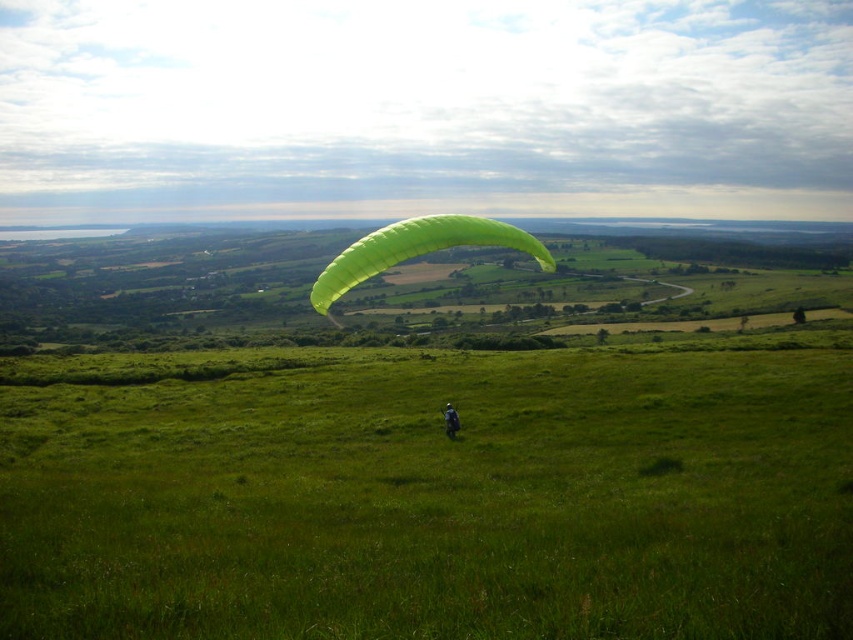
Is green grassy field at center closer to camera compared to green matte parachute at center?

Yes, green grassy field at center is in front of green matte parachute at center.

In the scene shown: Who is more distant from viewer, (646, 403) or (415, 234)?

The point (646, 403) is behind.

The height and width of the screenshot is (640, 853). I want to click on green grassy field at center, so click(437, 500).

The width and height of the screenshot is (853, 640). I want to click on green grassy field at center, so click(437, 500).

Which is below, green grassy field at center or green fabric paraglider at center?

green fabric paraglider at center

Who is positioned more to the right, green grassy field at center or green fabric paraglider at center?

Positioned to the right is green grassy field at center.

Between point (781, 625) and point (447, 429), which one is positioned behind?

The point (447, 429) is behind.

Find the location of a particular element. green grassy field at center is located at coordinates (437, 500).

Is point (544, 266) positioned in front of point (450, 420)?

Yes, point (544, 266) is in front of point (450, 420).

Does green matte parachute at center have a lesser width compared to green fabric paraglider at center?

Incorrect, green matte parachute at center's width is not less than green fabric paraglider at center's.

Identify the location of green matte parachute at center. (416, 250).